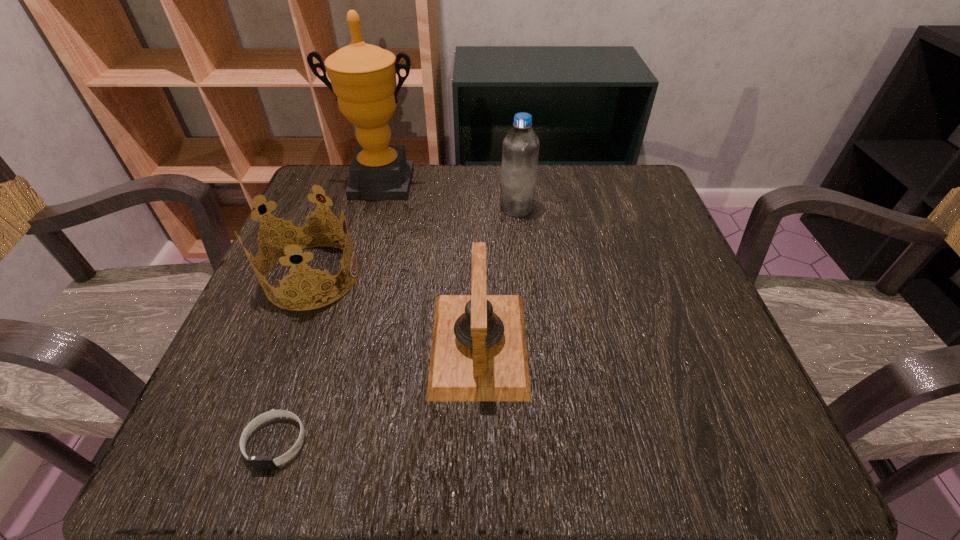
The height and width of the screenshot is (540, 960). Find the location of `free spot between the wristband and the crown`. free spot between the wristband and the crown is located at coordinates (295, 359).

This screenshot has height=540, width=960. I want to click on free point between the crown and the shortest object, so click(x=295, y=359).

Where is `vacant space in between the crown and the water bottle`? This screenshot has width=960, height=540. vacant space in between the crown and the water bottle is located at coordinates (415, 242).

Select which object appears as the fourth closest to the crown. Please provide its 2D coordinates. Your answer should be formatted as a tuple, i.e. [(x, y)], where the tuple contains the x and y coordinates of a point satisfying the conditions above.

[(520, 151)]

The height and width of the screenshot is (540, 960). I want to click on object that is the closest one to the crown, so click(479, 353).

Where is `vacant point that satisfies the following two spatial constraints: 1. at the front of the award with handles; 2. on the right side of the water bottle`? The image size is (960, 540). vacant point that satisfies the following two spatial constraints: 1. at the front of the award with handles; 2. on the right side of the water bottle is located at coordinates (374, 207).

Locate an element on the screen. The width and height of the screenshot is (960, 540). free space that satisfies the following two spatial constraints: 1. at the front of the award with handles; 2. on the right side of the second tallest object is located at coordinates (374, 207).